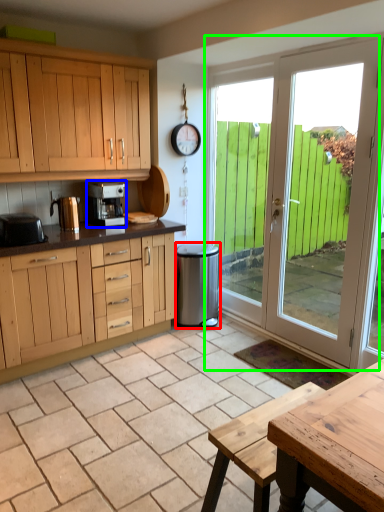
Question: Estimate the real-world distances between objects in this image. Which object is farther from appliance (highlighted by a red box), kitchen appliance (highlighted by a blue box) or door (highlighted by a green box)?

Choices:
 (A) kitchen appliance
 (B) door

Answer: (B)